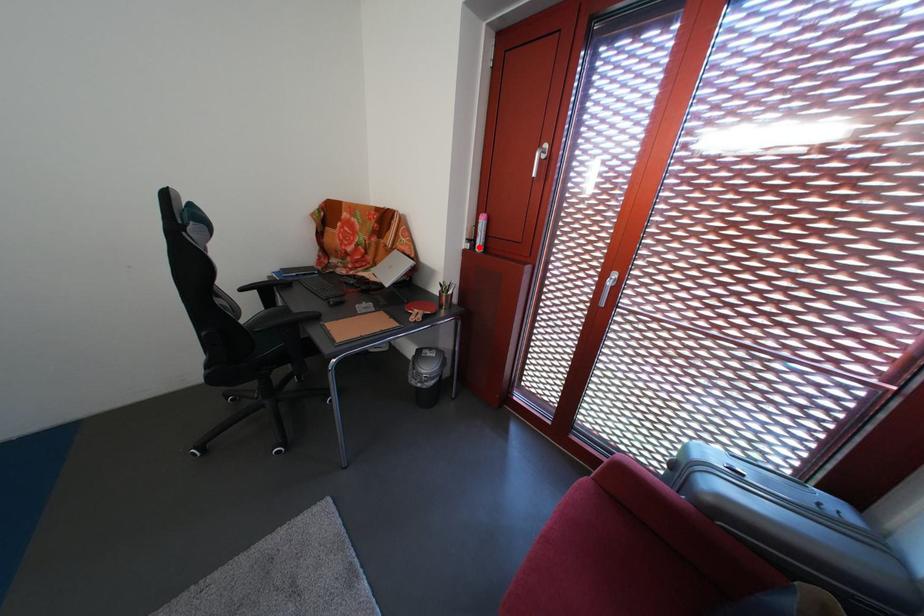
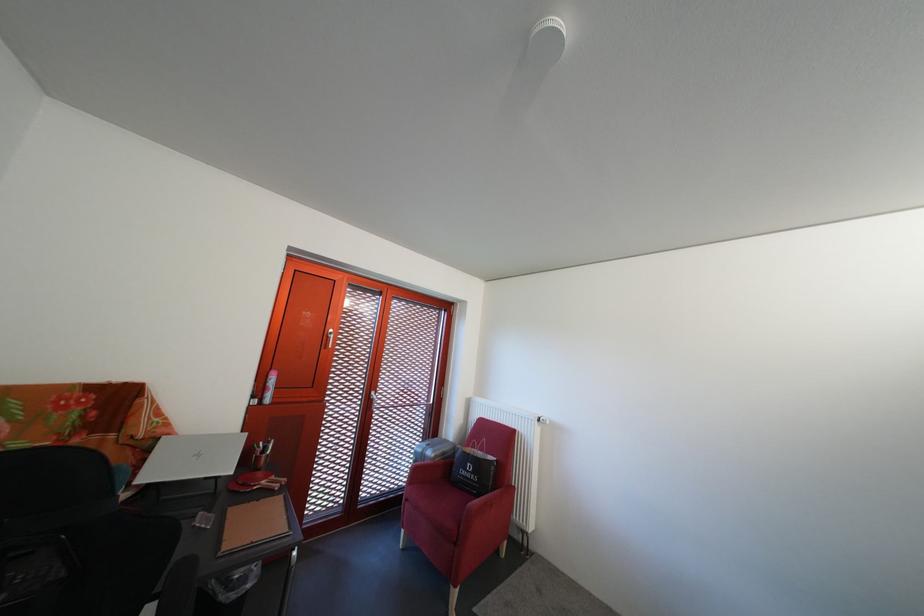
In the second image, find the point that corresponds to the highlighted location in the first image.

(263, 403)